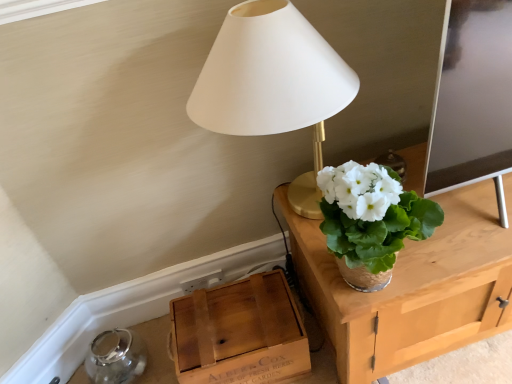
Question: Is woven straw vase at upper right wider or thinner than wooden crate at lower left?

Choices:
 (A) thin
 (B) wide

Answer: (A)

Question: In terms of size, does woven straw vase at upper right appear bigger or smaller than wooden crate at lower left?

Choices:
 (A) small
 (B) big

Answer: (A)

Question: Based on their relative distances, which object is farther from the white matte lampshade at upper center?

Choices:
 (A) woven straw vase at upper right
 (B) wooden crate at lower left

Answer: (B)

Question: Estimate the real-world distances between objects in this image. Which object is farther from the wooden crate at lower left?

Choices:
 (A) woven straw vase at upper right
 (B) white matte lampshade at upper center

Answer: (B)